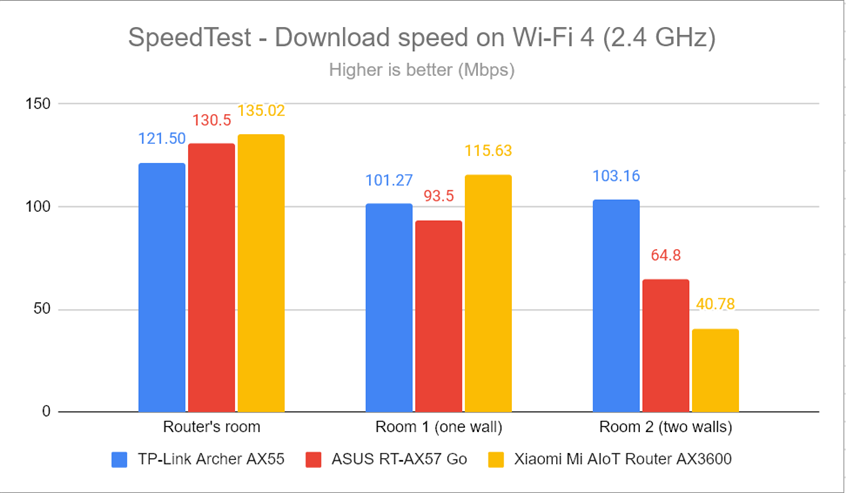
This screenshot has width=846, height=493. What are the coordinates of `room 1 (one wall)` in the screenshot? It's located at (377, 425).